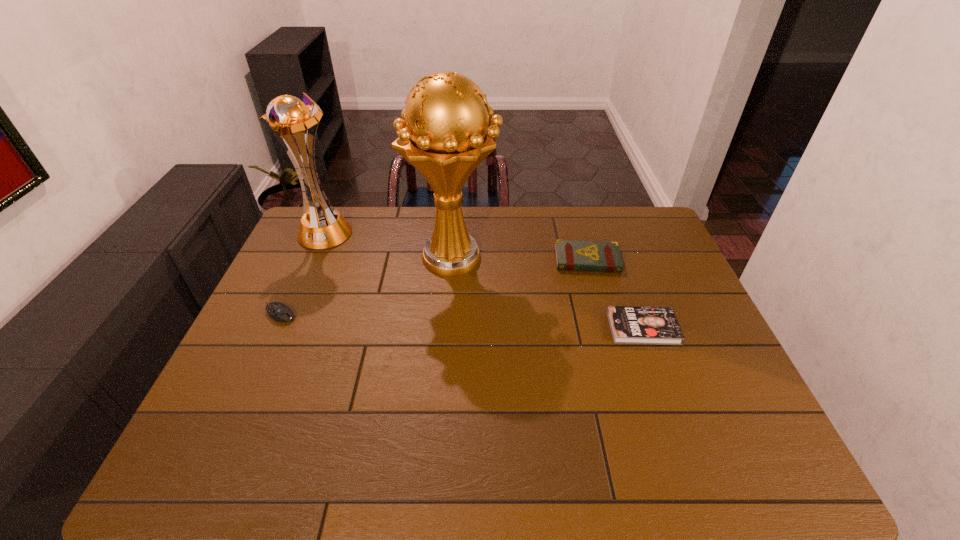
The height and width of the screenshot is (540, 960). What are the coordinates of `vacant space at the left edge of the desktop` in the screenshot? It's located at (309, 255).

You are a GUI agent. You are given a task and a screenshot of the screen. Output one action in this format:
    pyautogui.click(x=<x>, y=<y>)
    Task: Click on the vacant area at the right edge of the desktop
    
    Given the screenshot: What is the action you would take?
    pyautogui.click(x=747, y=422)

Image resolution: width=960 pixels, height=540 pixels. In order to click on free spot at the near right corner of the desktop in this screenshot , I will do `click(706, 457)`.

Identify the location of unoccupied position between the taller book and the computer mouse. This screenshot has height=540, width=960. (433, 287).

Where is `free space between the right trophy and the taller book`? free space between the right trophy and the taller book is located at coordinates (520, 258).

Locate an element on the screen. Image resolution: width=960 pixels, height=540 pixels. vacant region between the fourth shortest object and the shorter book is located at coordinates (484, 280).

The image size is (960, 540). What are the coordinates of `free space between the nearer book and the taller trophy` in the screenshot? It's located at (548, 292).

Where is `vacant space in between the taller book and the taller trophy`? vacant space in between the taller book and the taller trophy is located at coordinates (520, 258).

Locate an element on the screen. free space that is in between the shorter book and the taller book is located at coordinates (615, 294).

Find the location of a particular element. free point between the nearer book and the computer mouse is located at coordinates (461, 321).